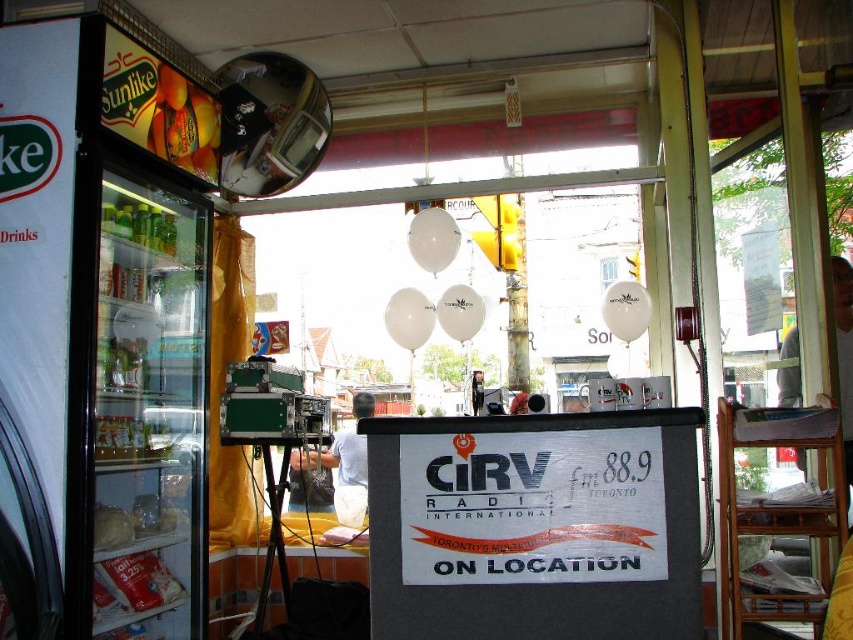
Question: Among these points, which one is nearest to the camera?

Choices:
 (A) (193, 132)
 (B) (347, 449)

Answer: (A)

Question: Which point appears closest to the camera in this image?

Choices:
 (A) (181, 156)
 (B) (364, 401)

Answer: (A)

Question: Does shiny plastic oranges at upper left appear over white fabric shirt at center?

Choices:
 (A) yes
 (B) no

Answer: (A)

Question: Is shiny plastic oranges at upper left below white fabric shirt at center?

Choices:
 (A) no
 (B) yes

Answer: (A)

Question: Does shiny plastic oranges at upper left appear under white fabric shirt at center?

Choices:
 (A) no
 (B) yes

Answer: (A)